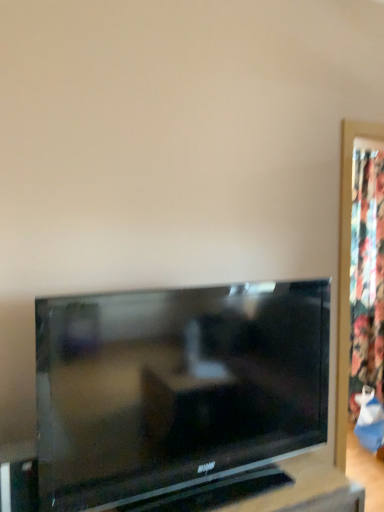
Identify the location of matte black tv at center. Image resolution: width=384 pixels, height=512 pixels. (175, 387).

The width and height of the screenshot is (384, 512). What do you see at coordinates (175, 387) in the screenshot?
I see `matte black tv at center` at bounding box center [175, 387].

What do you see at coordinates (367, 277) in the screenshot? I see `floral fabric curtain at right` at bounding box center [367, 277].

At what (x,y) coordinates should I click in order to perform the action: click on floral fabric curtain at right. Please return your answer as a coordinate pair (x, y). Looking at the image, I should click on (367, 277).

Identify the location of matte black tv at center. The height and width of the screenshot is (512, 384). (175, 387).

Which is more to the left, floral fabric curtain at right or matte black tv at center?

From the viewer's perspective, matte black tv at center appears more on the left side.

Which object is further away from the camera, floral fabric curtain at right or matte black tv at center?

floral fabric curtain at right is behind.

Which is behind, point (353, 373) or point (84, 445)?

Positioned behind is point (353, 373).

From the image's perspective, is floral fabric curtain at right under matte black tv at center?

No, from the image's perspective, floral fabric curtain at right is not below matte black tv at center.

From a real-world perspective, who is located lower, floral fabric curtain at right or matte black tv at center?

matte black tv at center, from a real-world perspective.

Can you confirm if floral fabric curtain at right is thinner than matte black tv at center?

In fact, floral fabric curtain at right might be wider than matte black tv at center.

Considering the sizes of objects floral fabric curtain at right and matte black tv at center in the image provided, who is taller, floral fabric curtain at right or matte black tv at center?

floral fabric curtain at right is taller.

Considering the relative sizes of floral fabric curtain at right and matte black tv at center in the image provided, is floral fabric curtain at right smaller than matte black tv at center?

No, floral fabric curtain at right is not smaller than matte black tv at center.

Is floral fabric curtain at right situated inside matte black tv at center or outside?

floral fabric curtain at right exists outside the volume of matte black tv at center.

Is floral fabric curtain at right with matte black tv at center?

No, floral fabric curtain at right is not next to matte black tv at center.

From the picture: Could you tell me if floral fabric curtain at right is turned towards matte black tv at center?

No, floral fabric curtain at right is not facing towards matte black tv at center.

This screenshot has width=384, height=512. I want to click on curtain above the matte black tv at center (from the image's perspective), so click(x=367, y=277).

Which object is positioned more to the left, matte black tv at center or floral fabric curtain at right?

From the viewer's perspective, matte black tv at center appears more on the left side.

In the scene shown: Is matte black tv at center closer to the viewer compared to floral fabric curtain at right?

That is True.

Is point (169, 372) farther from viewer compared to point (360, 313)?

No.

From the image's perspective, does matte black tv at center appear lower than floral fabric curtain at right?

Yes, from the image's perspective, matte black tv at center is beneath floral fabric curtain at right.

From a real-world perspective, which object rests below the other?

In real-world perspective, matte black tv at center is lower.

Does matte black tv at center have a greater width compared to floral fabric curtain at right?

No.

Is matte black tv at center taller than floral fabric curtain at right?

No.

Between matte black tv at center and floral fabric curtain at right, which one has larger size?

With larger size is floral fabric curtain at right.

Is matte black tv at center inside or outside of floral fabric curtain at right?

The correct answer is: outside.

Is matte black tv at center beside floral fabric curtain at right?

No, matte black tv at center is not with floral fabric curtain at right.

Could you tell me if matte black tv at center is turned towards floral fabric curtain at right?

No, matte black tv at center is not oriented towards floral fabric curtain at right.

How different are the orientations of matte black tv at center and floral fabric curtain at right in degrees?

They differ by 89.5 degrees in their facing directions.

How far apart are matte black tv at center and floral fabric curtain at right?

The distance of matte black tv at center from floral fabric curtain at right is 1.12 meters.

The height and width of the screenshot is (512, 384). What are the coordinates of `curtain located behind the matte black tv at center` in the screenshot? It's located at (367, 277).

I want to click on curtain located above the matte black tv at center (from the image's perspective), so click(x=367, y=277).

At what (x,y) coordinates should I click in order to perform the action: click on curtain above the matte black tv at center (from a real-world perspective). Please return your answer as a coordinate pair (x, y). This screenshot has width=384, height=512. Looking at the image, I should click on (367, 277).